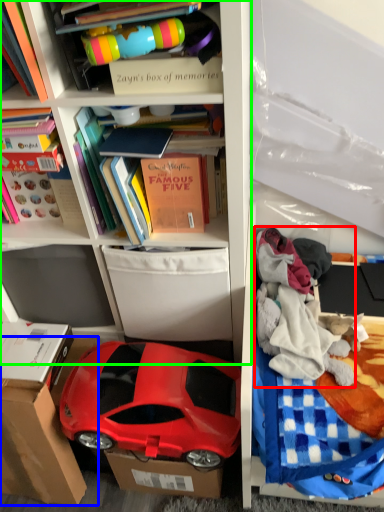
Question: Based on their relative distances, which object is farther from clothing (highlighted by a red box)? Choose from cardboard box (highlighted by a blue box) and shelf (highlighted by a green box).

Choices:
 (A) cardboard box
 (B) shelf

Answer: (A)